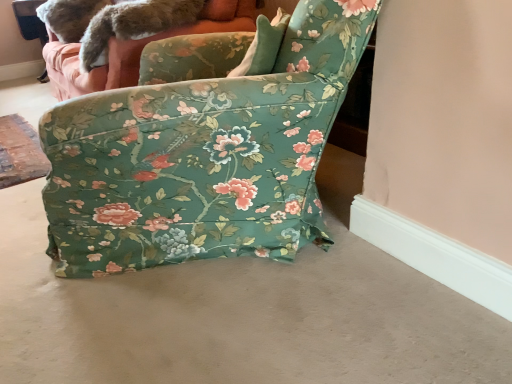
Locate an element on the screen. vacant point above beige carpet at lower center (from a real-world perspective) is located at coordinates pyautogui.click(x=329, y=327).